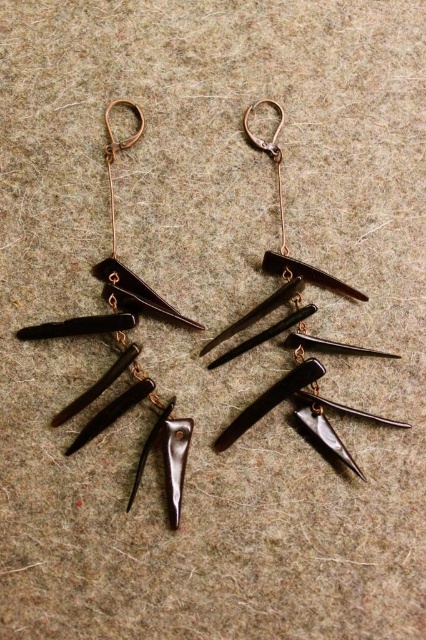
Question: Among these objects, which one is farthest from the camera?

Choices:
 (A) matte black spike at upper center
 (B) matte black spike at upper left

Answer: (A)

Question: Can you confirm if matte black spike at upper left is smaller than matte black spike at upper center?

Choices:
 (A) no
 (B) yes

Answer: (A)

Question: Is matte black spike at upper left to the left of matte black spike at upper center from the viewer's perspective?

Choices:
 (A) no
 (B) yes

Answer: (B)

Question: Which object appears closest to the camera in this image?

Choices:
 (A) matte black spike at upper center
 (B) matte black spike at upper left

Answer: (B)

Question: Is matte black spike at upper left wider than matte black spike at upper center?

Choices:
 (A) yes
 (B) no

Answer: (B)